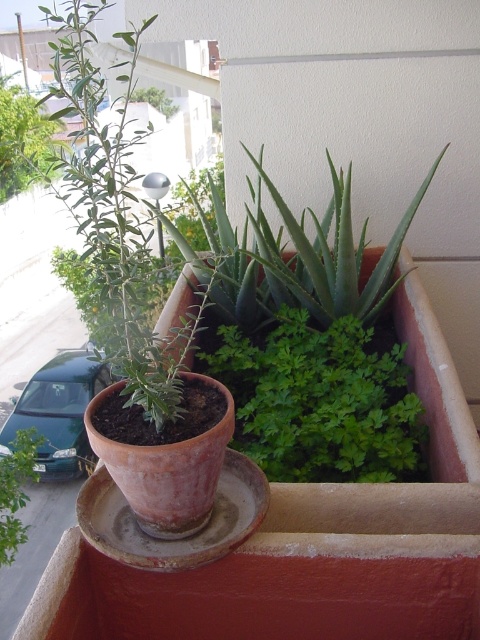
From the picture: Between green leafy plant at upper left and green leafy plant at left, which one is positioned lower?

green leafy plant at left is below.

Who is positioned more to the right, green leafy plant at upper left or green leafy plant at left?

green leafy plant at left is more to the right.

Between point (22, 180) and point (3, 513), which one is positioned behind?

Positioned behind is point (22, 180).

The image size is (480, 640). In order to click on green leafy plant at upper left in this screenshot , I will do `click(24, 140)`.

Can you confirm if green leafy plant at center is taller than green leafy plant at upper left?

No, green leafy plant at center is not taller than green leafy plant at upper left.

Consider the image. Who is more distant from viewer, (416, 196) or (13, 177)?

The point (13, 177) is more distant.

Where is `green leafy plant at center`? Image resolution: width=480 pixels, height=640 pixels. green leafy plant at center is located at coordinates (307, 339).

Is green matte plant at center in front of green leafy plant at left?

Yes.

Looking at this image, is green matte plant at center below green leafy plant at left?

No.

Describe the element at coordinates (113, 216) in the screenshot. I see `green matte plant at center` at that location.

This screenshot has width=480, height=640. What are the coordinates of `green matte plant at center` in the screenshot? It's located at 113,216.